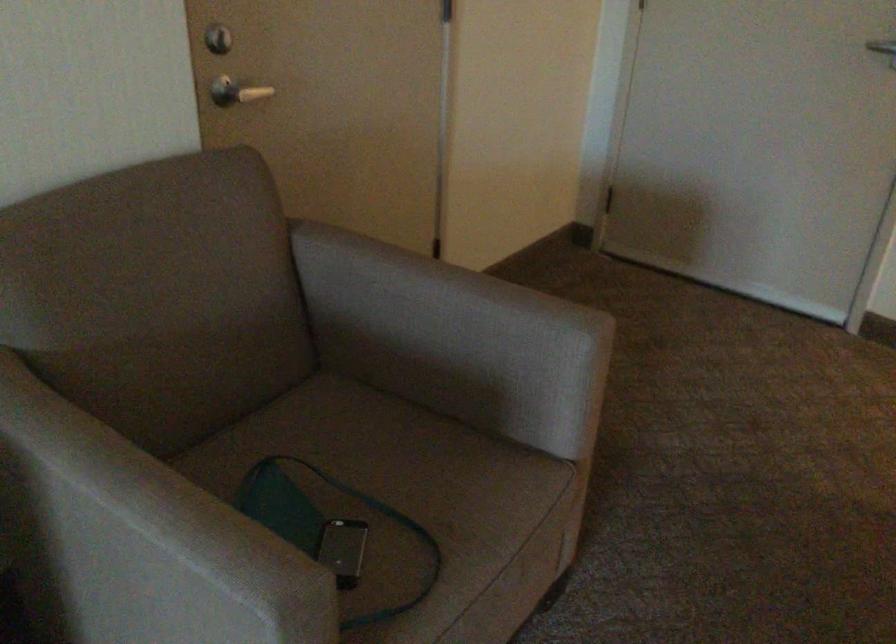
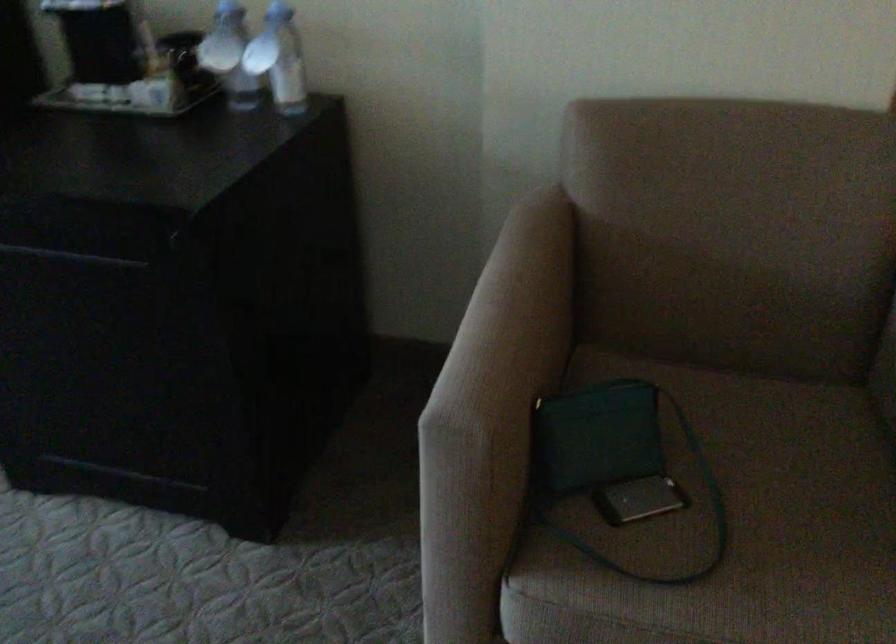
The point at (308, 545) is marked in the first image. Where is the corresponding point in the second image?

(614, 464)